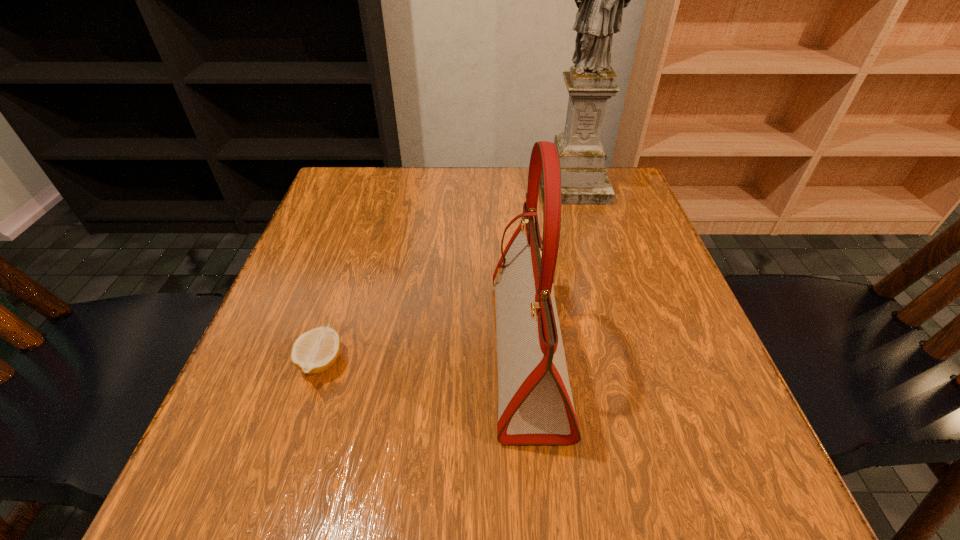
Where is `object located at the left edge`? The image size is (960, 540). object located at the left edge is located at coordinates (314, 351).

Identify the location of object located at the right edge. (600, 0).

Identify the location of object at the far right corner. The height and width of the screenshot is (540, 960). (600, 0).

Identify the location of free space at the far edge of the desktop. The height and width of the screenshot is (540, 960). (396, 168).

Where is `vacant space at the near edge of the desktop`? Image resolution: width=960 pixels, height=540 pixels. vacant space at the near edge of the desktop is located at coordinates (469, 494).

I want to click on vacant region at the left edge of the desktop, so click(x=251, y=366).

The height and width of the screenshot is (540, 960). Identify the location of free spot at the right edge of the desktop. pyautogui.click(x=659, y=321).

This screenshot has height=540, width=960. In the image, there is a desktop. Find the location of `vacant space at the far left corner`. vacant space at the far left corner is located at coordinates (384, 190).

In the image, there is a desktop. Where is `free space at the near left corner`? free space at the near left corner is located at coordinates (202, 458).

Locate an element on the screen. Image resolution: width=960 pixels, height=540 pixels. free space at the far right corner of the desktop is located at coordinates (639, 207).